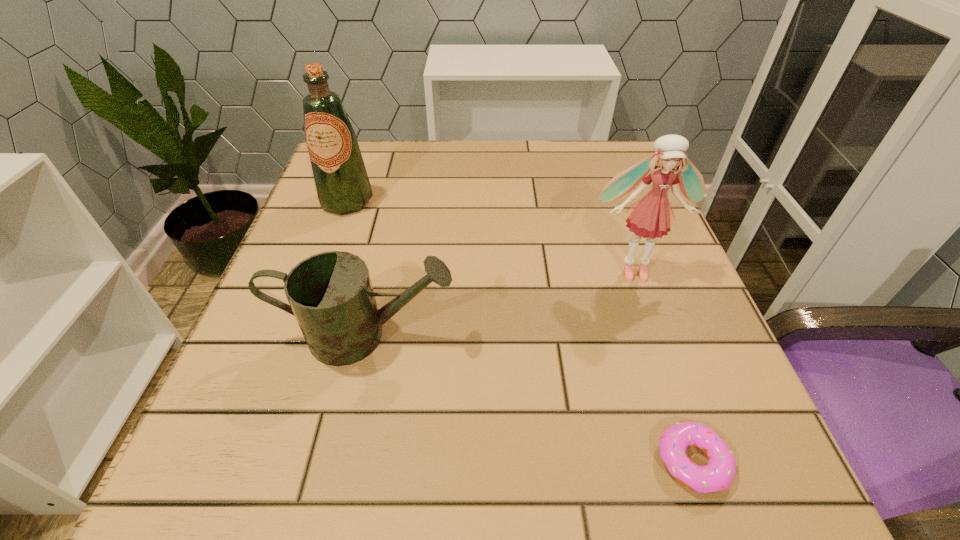
Image resolution: width=960 pixels, height=540 pixels. I want to click on vacant area between the farthest object and the second farthest object, so click(x=490, y=235).

Locate an element on the screen. This screenshot has height=540, width=960. object that is the second nearest to the nearest object is located at coordinates (330, 294).

I want to click on object identified as the third closest to the doll, so click(341, 181).

Locate an element on the screen. The image size is (960, 540). vacant region that satisfies the following two spatial constraints: 1. with the spout on the watering can; 2. on the right side of the nearest object is located at coordinates (337, 462).

Locate an element on the screen. This screenshot has height=540, width=960. vacant space that satisfies the following two spatial constraints: 1. on the front-facing side of the doll; 2. with the spout on the second nearest object is located at coordinates (656, 336).

This screenshot has width=960, height=540. I want to click on vacant space that satisfies the following two spatial constraints: 1. on the front-facing side of the third nearest object; 2. with the spout on the second shortest object, so click(656, 336).

You are a GUI agent. You are given a task and a screenshot of the screen. Output one action in this format:
    pyautogui.click(x=<x>, y=<y>)
    Task: Click on the free space that satisfies the following two spatial constraints: 1. on the front-facing side of the second farthest object; 2. with the spout on the third farthest object
    The height and width of the screenshot is (540, 960).
    Given the screenshot: What is the action you would take?
    pyautogui.click(x=656, y=336)